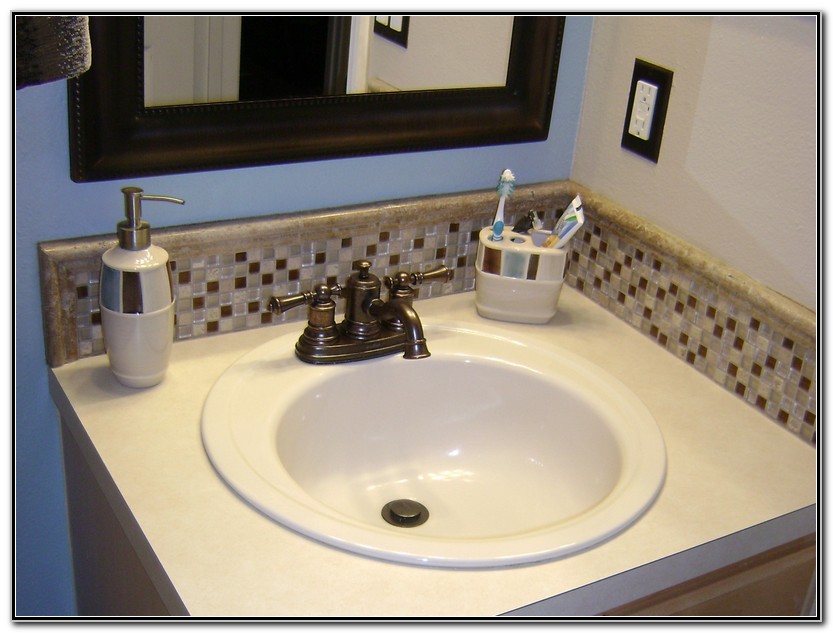
Image resolution: width=833 pixels, height=633 pixels. Identify the location of white wall background. (692, 223).